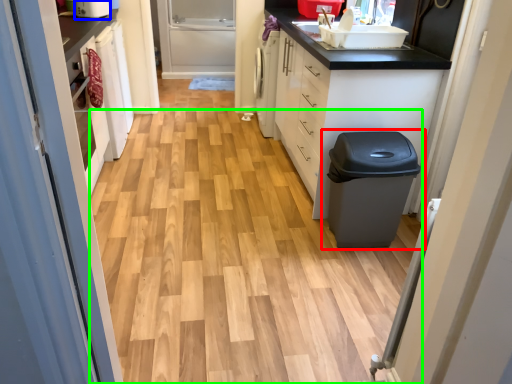
Question: Based on their relative distances, which object is farther from waste container (highlighted by a red box)? Choose from appliance (highlighted by a blue box) and plain (highlighted by a green box).

Choices:
 (A) appliance
 (B) plain

Answer: (A)